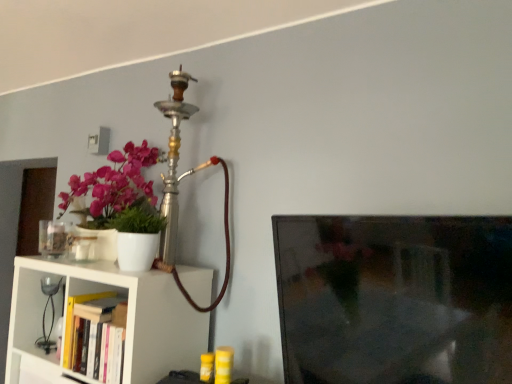
Question: Considering their positions, is black glass table lamp at left located in front of or behind hardcover book at lower left?

Choices:
 (A) behind
 (B) front

Answer: (A)

Question: Considering the positions of black glass table lamp at left and hardcover book at lower left in the image, is black glass table lamp at left bigger or smaller than hardcover book at lower left?

Choices:
 (A) small
 (B) big

Answer: (B)

Question: Which is nearer to the white matte shelf at lower left?

Choices:
 (A) black glass table lamp at left
 (B) hardcover book at lower left

Answer: (B)

Question: Which object is positioned closest to the white matte shelf at lower left?

Choices:
 (A) hardcover book at lower left
 (B) black glass table lamp at left

Answer: (A)